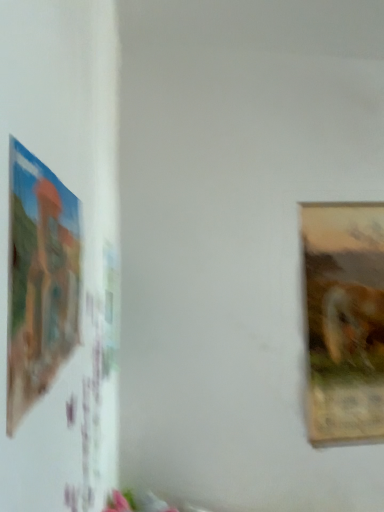
Question: From a real-world perspective, relative to wooden textured frame at right, the second picture frame in the left-to-right sequence, is matte plastic picture frame at left, the 2th picture frame from the right, vertically above or below?

Choices:
 (A) above
 (B) below

Answer: (A)

Question: In terms of height, does matte plastic picture frame at left, marked as the second picture frame in a back-to-front arrangement, look taller or shorter compared to wooden textured frame at right, marked as the 1th picture frame in a back-to-front arrangement?

Choices:
 (A) tall
 (B) short

Answer: (B)

Question: Which is correct: matte plastic picture frame at left, arranged as the first picture frame when viewed from the left, is inside wooden textured frame at right, arranged as the 2th picture frame when viewed from the front, or outside of it?

Choices:
 (A) inside
 (B) outside

Answer: (B)

Question: From the image's perspective, is wooden textured frame at right, the second picture frame in the left-to-right sequence, located above or below matte plastic picture frame at left, arranged as the first picture frame when viewed from the left?

Choices:
 (A) above
 (B) below

Answer: (B)

Question: In the image, is wooden textured frame at right, marked as the 1th picture frame in a back-to-front arrangement, positioned in front of or behind matte plastic picture frame at left, the 1th picture frame in the front-to-back sequence?

Choices:
 (A) front
 (B) behind

Answer: (B)

Question: Is wooden textured frame at right, positioned as the 1th picture frame in right-to-left order, bigger or smaller than matte plastic picture frame at left, the 2th picture frame from the right?

Choices:
 (A) small
 (B) big

Answer: (B)

Question: Is wooden textured frame at right, marked as the 1th picture frame in a back-to-front arrangement, to the left or to the right of matte plastic picture frame at left, arranged as the first picture frame when viewed from the left, in the image?

Choices:
 (A) right
 (B) left

Answer: (A)